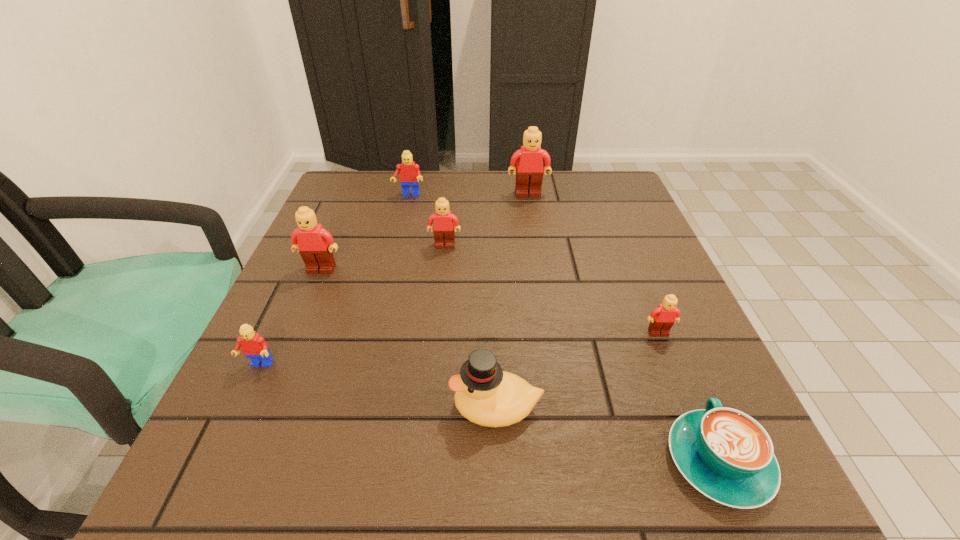
The width and height of the screenshot is (960, 540). What are the coordinates of `object located at the near right corner` in the screenshot? It's located at (725, 454).

This screenshot has width=960, height=540. In the image, there is a desktop. Identify the location of free space at the far edge. (482, 212).

Where is `blank space at the near edge of the desktop`? Image resolution: width=960 pixels, height=540 pixels. blank space at the near edge of the desktop is located at coordinates (423, 482).

Where is `vacant space at the left edge of the desktop`? The image size is (960, 540). vacant space at the left edge of the desktop is located at coordinates (376, 246).

In the image, there is a desktop. Identify the location of blank space at the right edge. This screenshot has width=960, height=540. (692, 400).

In the image, there is a desktop. Where is `vacant space at the far right corner`? vacant space at the far right corner is located at coordinates (599, 204).

Find the location of a particular element. free area in between the cappuccino and the duck is located at coordinates (607, 434).

Locate an element on the screen. The height and width of the screenshot is (540, 960). free spot between the shortest object and the fifth nearest object is located at coordinates (519, 366).

The height and width of the screenshot is (540, 960). Find the location of `empty space between the second nearest Lego and the sixth farthest object`. empty space between the second nearest Lego and the sixth farthest object is located at coordinates (459, 349).

You are a GUI agent. You are given a task and a screenshot of the screen. Output one action in this format:
    pyautogui.click(x=<x>, y=<y>)
    Task: Click on the free spot between the duck and the cappuccino
    The image size is (960, 540).
    Given the screenshot: What is the action you would take?
    pyautogui.click(x=607, y=434)